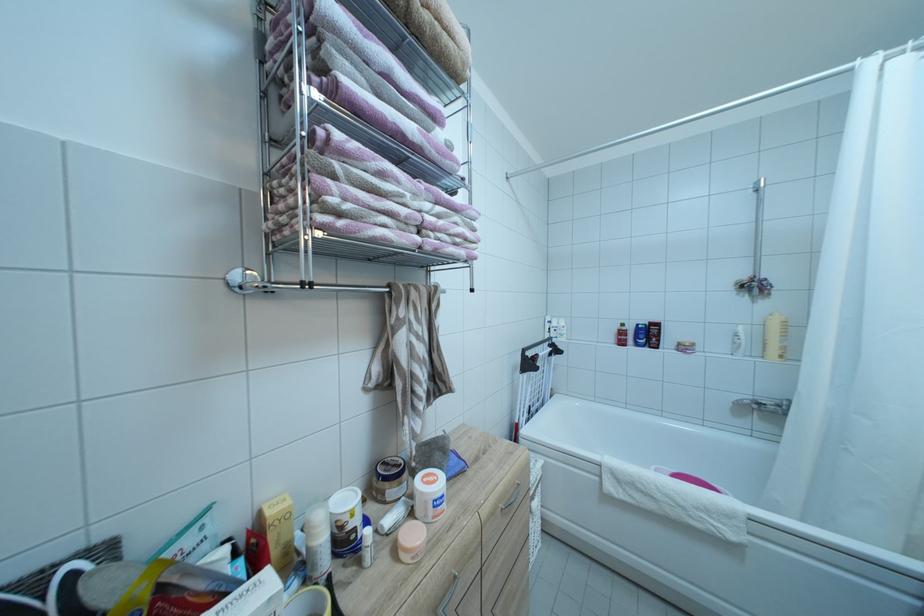
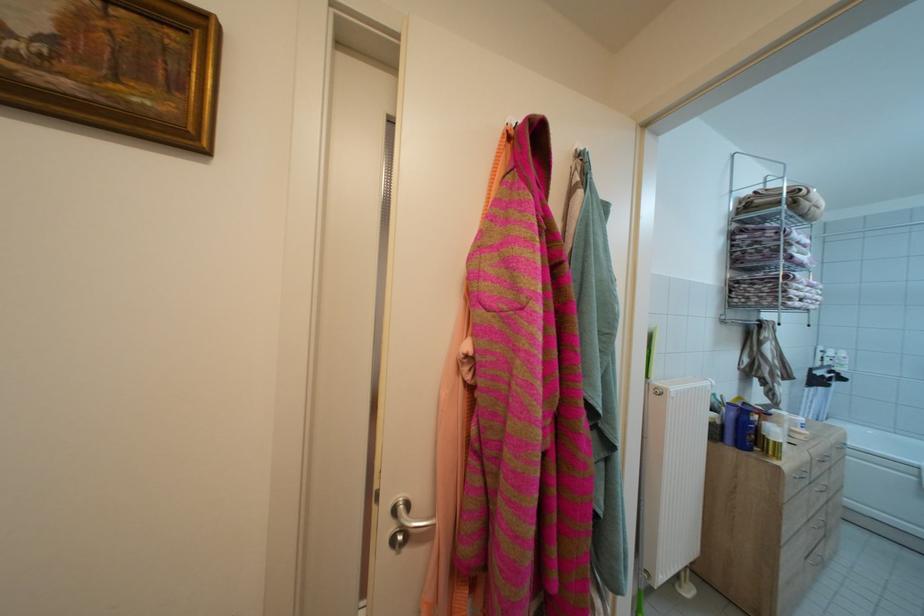
In a continuous first-person perspective shot, in which direction is the camera moving?

The movement direction of the cameraman is left, backward.